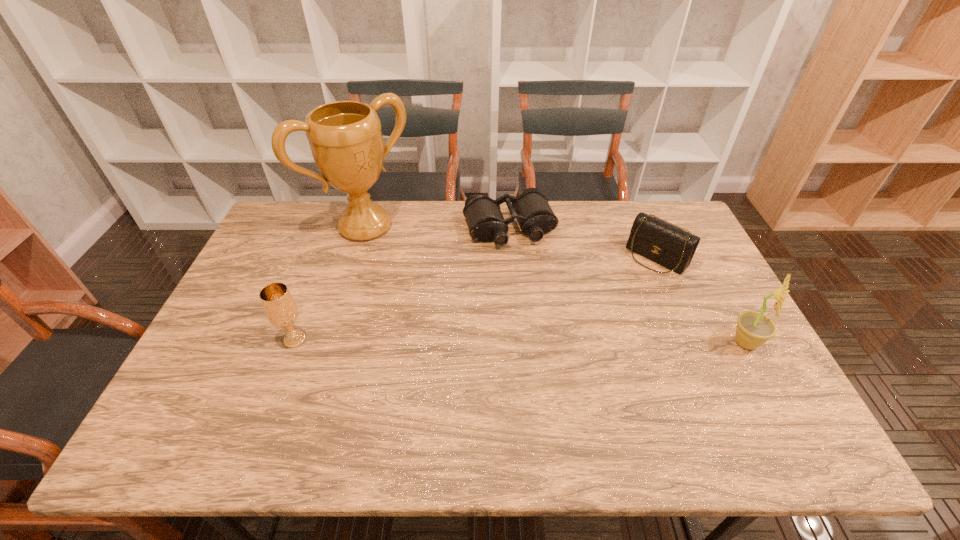
You are a GUI agent. You are given a task and a screenshot of the screen. Output one action in this format:
    pyautogui.click(x=<x>, y=<y>)
    Task: Click on the vacant region located through the eyepieces of the shortest object
    This screenshot has width=960, height=540.
    Given the screenshot: What is the action you would take?
    pyautogui.click(x=539, y=293)

Locate an element on the screen. The width and height of the screenshot is (960, 540). free space located 0.240m through the eyepieces of the shortest object is located at coordinates (544, 306).

This screenshot has width=960, height=540. I want to click on vacant space positioned 0.250m on the front of the award with the decoration, so click(x=433, y=289).

The width and height of the screenshot is (960, 540). In order to click on vacant point located 0.150m on the front of the award with the decoration in this screenshot , I will do `click(415, 271)`.

This screenshot has height=540, width=960. I want to click on vacant area located on the front of the award with the decoration, so [x=459, y=316].

Locate an element on the screen. Image resolution: width=960 pixels, height=540 pixels. free point located on the front flap of the second shortest object is located at coordinates (628, 286).

The width and height of the screenshot is (960, 540). I want to click on vacant space located 0.390m on the front flap of the second shortest object, so click(570, 345).

Find the location of a particular element. vacant area situated on the front flap of the second shortest object is located at coordinates (605, 309).

At what (x,y) coordinates should I click in order to perform the action: click on binoculars that is at the far edge. Please return your answer as a coordinate pair (x, y). The width and height of the screenshot is (960, 540). Looking at the image, I should click on click(x=531, y=209).

At what (x,y) coordinates should I click in order to perform the action: click on award that is at the far edge. Please return your answer as a coordinate pair (x, y). Looking at the image, I should click on pyautogui.click(x=345, y=138).